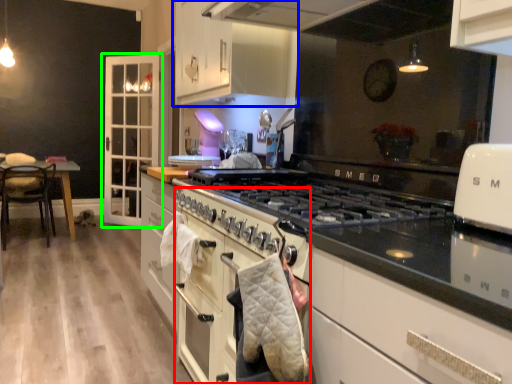
Question: Which is farther away from oven (highlighted by a red box)? cabinetry (highlighted by a blue box) or cabinetry (highlighted by a green box)?

Choices:
 (A) cabinetry
 (B) cabinetry

Answer: (B)